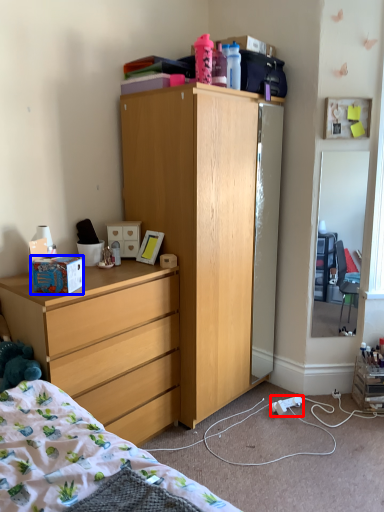
Question: Which of the following is the farthest to the observer, power outlet (highlighted by a red box) or box (highlighted by a blue box)?

Choices:
 (A) power outlet
 (B) box

Answer: (A)